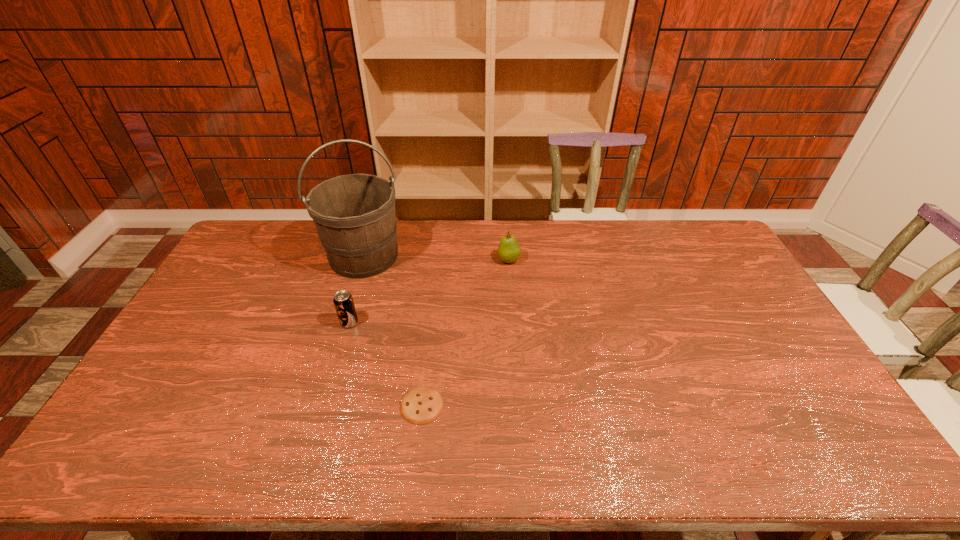
Locate an element on the screen. Image resolution: width=960 pixels, height=540 pixels. vacant space that satisfies the following two spatial constraints: 1. on the back side of the soda can; 2. on the right side of the pear is located at coordinates (368, 260).